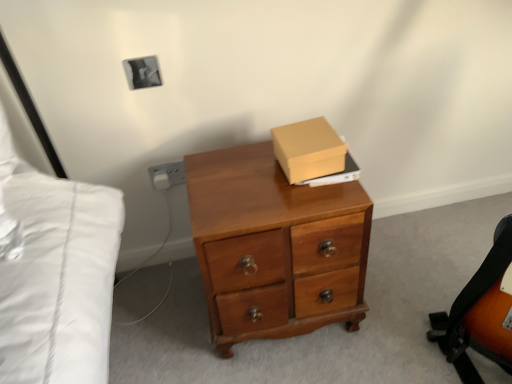
In order to face orange leather messenger bag at lower right, should I rotate leftwards or rightwards?

You should look right and rotate roughly 26.400 degrees.

This screenshot has height=384, width=512. In order to click on matte gray electric outlet at lower left in this screenshot , I will do [x=167, y=175].

Can you confirm if matte cardboard box at upper center is positioned to the right of matte gray electric outlet at lower left?

Yes.

From a real-world perspective, is matte cardboard box at upper center positioned over matte gray electric outlet at lower left based on gravity?

Correct, in the physical world, matte cardboard box at upper center is higher than matte gray electric outlet at lower left.

Choose the correct answer: Is matte cardboard box at upper center inside matte gray electric outlet at lower left or outside it?

The correct answer is: outside.

Does matte cardboard box at upper center come in front of matte gray electric outlet at lower left?

Yes, matte cardboard box at upper center is closer to the camera.

From a real-world perspective, is wooden desk at center above or below matte gray electric outlet at lower left?

From a real-world perspective, wooden desk at center is physically below matte gray electric outlet at lower left.

Considering the positions of points (290, 227) and (162, 175), is point (290, 227) farther from camera compared to point (162, 175)?

No.

Based on the photo, from the image's perspective, is wooden desk at center on top of matte gray electric outlet at lower left?

No.

Looking at their sizes, would you say matte gray electric outlet at lower left is wider or thinner than wooden desk at center?

Considering their sizes, matte gray electric outlet at lower left looks slimmer than wooden desk at center.

Is matte gray electric outlet at lower left far away from wooden desk at center?

They are positioned close to each other.

How distant is matte gray electric outlet at lower left from wooden desk at center?

matte gray electric outlet at lower left and wooden desk at center are 51.71 centimeters apart.

From the image's perspective, between matte gray electric outlet at lower left and wooden desk at center, which one is located above?

From the image's view, matte gray electric outlet at lower left is above.

Is orange leather messenger bag at lower right to the left of wooden desk at center from the viewer's perspective?

Incorrect, orange leather messenger bag at lower right is not on the left side of wooden desk at center.

Can wooden desk at center be found inside orange leather messenger bag at lower right?

No, wooden desk at center is not surrounded by orange leather messenger bag at lower right.

Considering their positions, is orange leather messenger bag at lower right located in front of or behind wooden desk at center?

orange leather messenger bag at lower right is behind wooden desk at center.

From the picture: From a real-world perspective, is orange leather messenger bag at lower right located higher than wooden desk at center?

No, from a real-world perspective, orange leather messenger bag at lower right is not over wooden desk at center

The height and width of the screenshot is (384, 512). In order to click on desk above the orange leather messenger bag at lower right (from a real-world perspective) in this screenshot , I will do click(275, 247).

Consider the image. Would you say wooden desk at center is inside or outside orange leather messenger bag at lower right?

wooden desk at center lies outside orange leather messenger bag at lower right.

Is point (281, 330) positioned in front of point (482, 318)?

No.

Consider the image. Does wooden desk at center lie behind orange leather messenger bag at lower right?

No, wooden desk at center is in front of orange leather messenger bag at lower right.

Is orange leather messenger bag at lower right inside the boundaries of matte cardboard box at upper center, or outside?

orange leather messenger bag at lower right is spatially situated outside matte cardboard box at upper center.

Considering the relative positions of orange leather messenger bag at lower right and matte cardboard box at upper center in the image provided, is orange leather messenger bag at lower right to the left of matte cardboard box at upper center from the viewer's perspective?

No, orange leather messenger bag at lower right is not to the left of matte cardboard box at upper center.

From a real-world perspective, is orange leather messenger bag at lower right on matte cardboard box at upper center?

No, from a real-world perspective, orange leather messenger bag at lower right is not over matte cardboard box at upper center

Is matte cardboard box at upper center facing towards wooden desk at center?

No.

Is matte cardboard box at upper center bigger than wooden desk at center?

Actually, matte cardboard box at upper center might be smaller than wooden desk at center.

Which object is closer to the camera, matte cardboard box at upper center or wooden desk at center?

wooden desk at center is in front.

This screenshot has width=512, height=384. I want to click on box behind the wooden desk at center, so click(x=308, y=149).

The height and width of the screenshot is (384, 512). Find the location of `electric outlet that appears on the left of matte cardboard box at upper center`. electric outlet that appears on the left of matte cardboard box at upper center is located at coordinates (167, 175).

The image size is (512, 384). What are the coordinates of `electric outlet above the wooden desk at center (from the image's perspective)` in the screenshot? It's located at (167, 175).

Estimate the real-world distances between objects in this image. Which object is closer to wooden desk at center, orange leather messenger bag at lower right or matte gray electric outlet at lower left?

orange leather messenger bag at lower right.

Estimate the real-world distances between objects in this image. Which object is closer to matte cardboard box at upper center, wooden desk at center or orange leather messenger bag at lower right?

wooden desk at center is closer to matte cardboard box at upper center.

Estimate the real-world distances between objects in this image. Which object is closer to matte cardboard box at upper center, orange leather messenger bag at lower right or matte gray electric outlet at lower left?

matte gray electric outlet at lower left is closer to matte cardboard box at upper center.

Estimate the real-world distances between objects in this image. Which object is closer to orange leather messenger bag at lower right, matte gray electric outlet at lower left or matte cardboard box at upper center?

Based on the image, matte cardboard box at upper center appears to be nearer to orange leather messenger bag at lower right.

Estimate the real-world distances between objects in this image. Which object is closer to matte gray electric outlet at lower left, wooden desk at center or matte cardboard box at upper center?

wooden desk at center.

When comparing their distances from matte cardboard box at upper center, does wooden desk at center or matte gray electric outlet at lower left seem further?

Based on the image, matte gray electric outlet at lower left appears to be further to matte cardboard box at upper center.

From the picture: Which object lies further to the anchor point wooden desk at center, matte cardboard box at upper center or matte gray electric outlet at lower left?

matte gray electric outlet at lower left is positioned further to the anchor wooden desk at center.

Estimate the real-world distances between objects in this image. Which object is closer to matte gray electric outlet at lower left, matte cardboard box at upper center or orange leather messenger bag at lower right?

Based on the image, matte cardboard box at upper center appears to be nearer to matte gray electric outlet at lower left.

What are the coordinates of `box between wooden desk at center and orange leather messenger bag at lower right in the horizontal direction` in the screenshot? It's located at (308, 149).

Find the location of a particular element. The height and width of the screenshot is (384, 512). desk between matte gray electric outlet at lower left and matte cardboard box at upper center from left to right is located at coordinates (275, 247).

Locate an element on the screen. The image size is (512, 384). box situated between matte gray electric outlet at lower left and orange leather messenger bag at lower right from left to right is located at coordinates (308, 149).

In order to click on desk between matte gray electric outlet at lower left and orange leather messenger bag at lower right from left to right in this screenshot , I will do `click(275, 247)`.